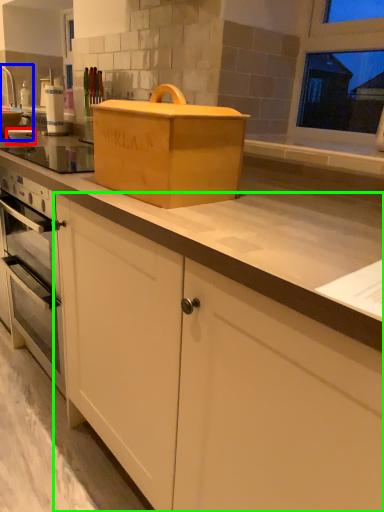
Question: Which object is the closest to the appliance (highlighted by a red box)? Choose among these: sink (highlighted by a blue box) or cabinetry (highlighted by a green box).

Choices:
 (A) sink
 (B) cabinetry

Answer: (A)